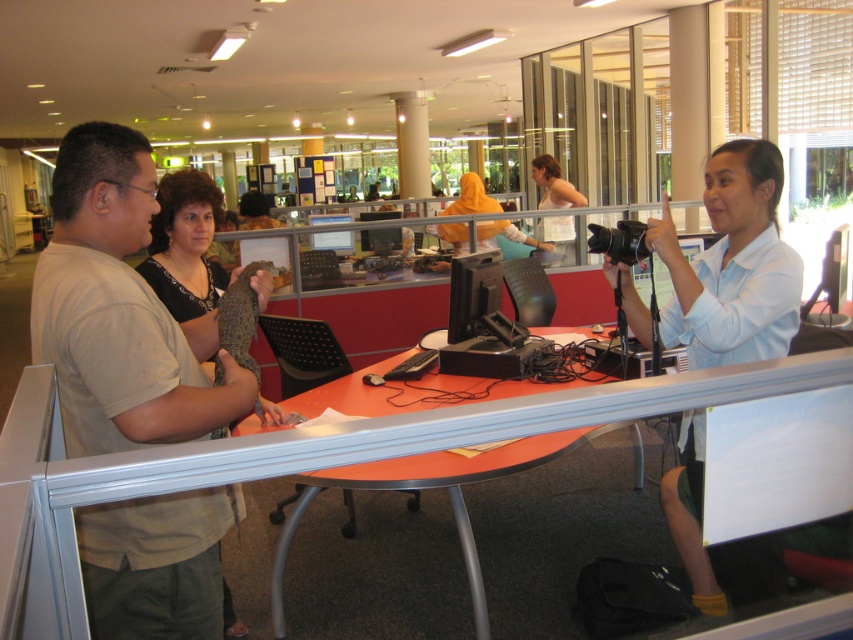
You are standing at the point marked by the coordinates point (120, 310) in the office scene. What object or person are you facing directly?

The point (120, 310) corresponds to the light brown shirt at left, so you are facing the light brown shirt at left directly.

You are an office worker who needs to place a new document on the orange plastic table at center. However, there is a light brown leather jacket at left in the way. Can you move the jacket to access the table?

The orange plastic table at center is located below the light brown leather jacket at left, so you can move the light brown leather jacket at left to access the orange plastic table at center.

You are an office worker who needs to determine which clothing item is narrower between the light brown shirt at left and the orange fabric headscarf at center. Based on the scene, which one is narrower?

The light brown shirt at left is narrower than the orange fabric headscarf at center as per the description.